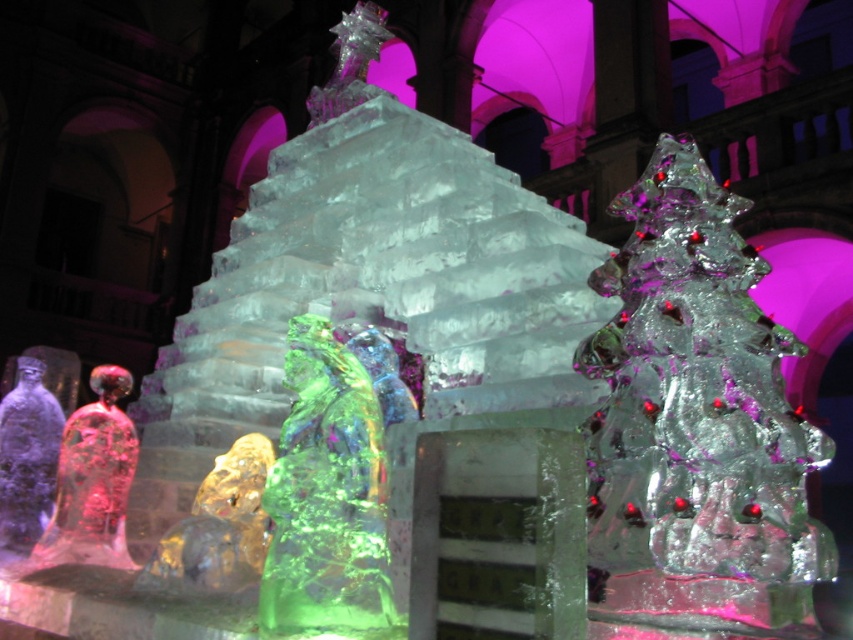
Does transparent ice christmas tree at center have a smaller size compared to translucent ice figure at left?

Indeed, transparent ice christmas tree at center has a smaller size compared to translucent ice figure at left.

Is transparent ice christmas tree at center positioned behind translucent ice figure at left?

No.

You are a GUI agent. You are given a task and a screenshot of the screen. Output one action in this format:
    pyautogui.click(x=<x>, y=<y>)
    Task: Click on the transparent ice christmas tree at center
    Image resolution: width=853 pixels, height=640 pixels.
    Given the screenshot: What is the action you would take?
    pyautogui.click(x=695, y=428)

Could you measure the distance between green translucent ice sculpture at center and transparent glass figure at lower left?

A distance of 7.68 meters exists between green translucent ice sculpture at center and transparent glass figure at lower left.

Between point (352, 586) and point (61, 557), which one is positioned behind?

The point (61, 557) is more distant.

Locate an element on the screen. This screenshot has height=640, width=853. green translucent ice sculpture at center is located at coordinates (328, 499).

Who is shorter, transparent glass figure at lower left or translucent amber bear at center?

With less height is translucent amber bear at center.

Describe the element at coordinates (91, 481) in the screenshot. Image resolution: width=853 pixels, height=640 pixels. I see `transparent glass figure at lower left` at that location.

The image size is (853, 640). In order to click on transparent glass figure at lower left in this screenshot , I will do click(x=91, y=481).